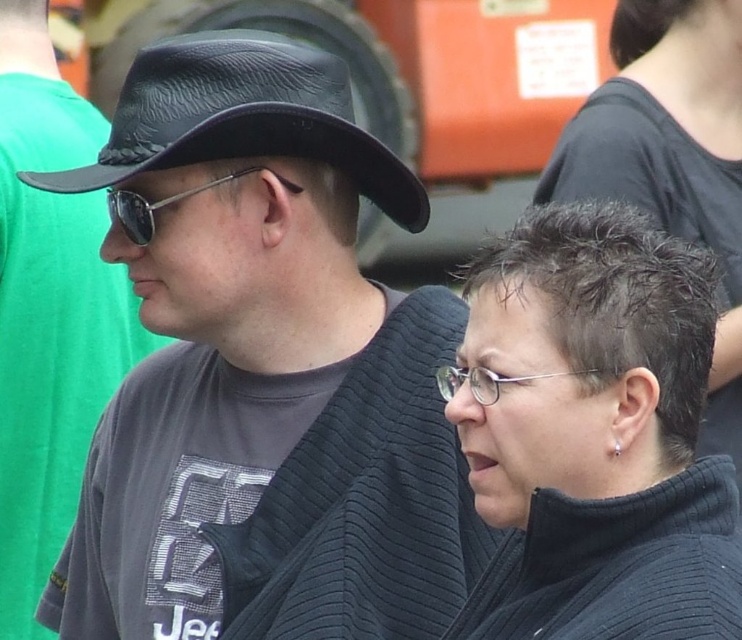
You are a photographer trying to capture both the black leather hat at left and the matte black hat at left in a single frame. Given their heights, which hat will appear smaller in the photo?

The black leather hat at left has a lesser height compared to the matte black hat at left, so it will appear smaller in the photo.

You are a photographer trying to capture a clear shot of the black leather hat at left from your current position. Given that the hat is 4.03 meters away, and your camera has a maximum focus range of 3.5 meters, will you be able to focus on the hat?

The black leather hat at left is 4.03 meters away from the camera, which exceeds the camera maximum focus range of 3.5 meters. Therefore, the camera cannot focus on the hat.